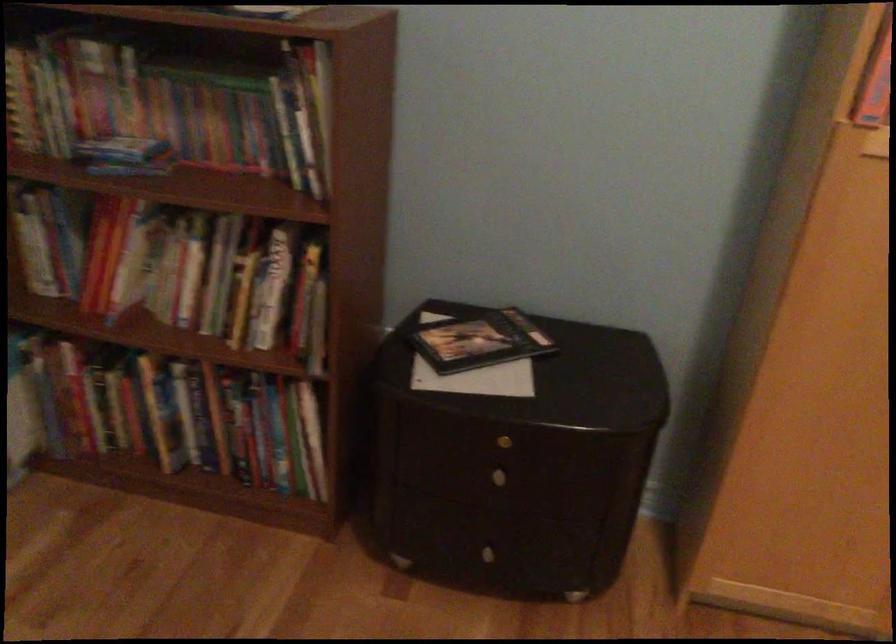
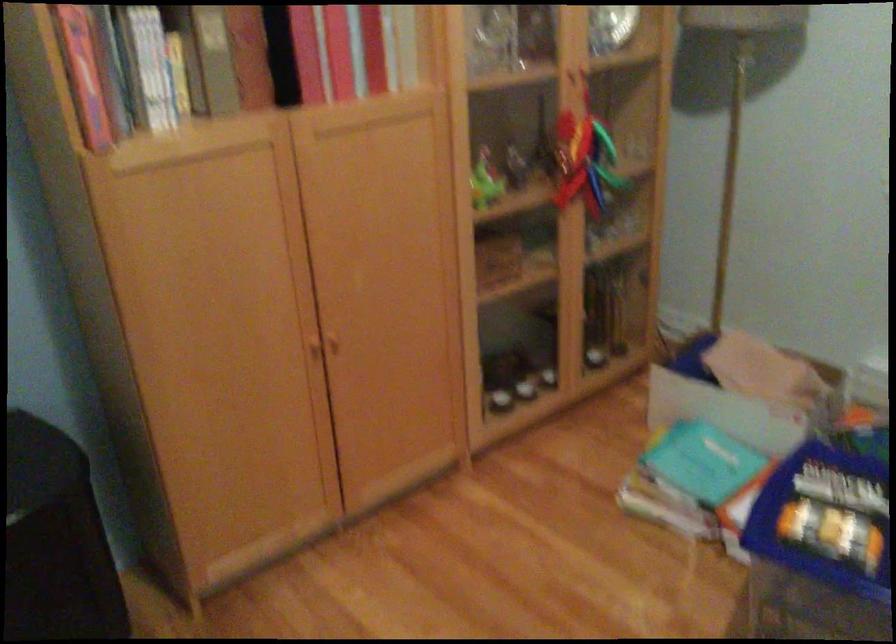
Question: The camera is either moving clockwise (left) or counter-clockwise (right) around the object. The first image is from the beginning of the video and the second image is from the end. Is the camera moving left or right when shooting the video?

Choices:
 (A) Left
 (B) Right

Answer: (A)